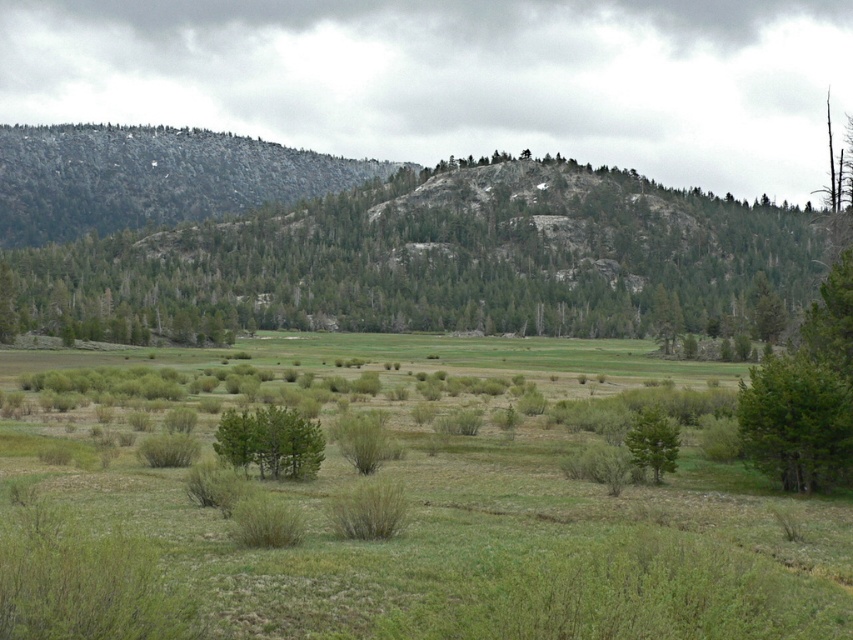
Which of these two, green leafy tree at upper center or rocky gray mountain at left, stands taller?

rocky gray mountain at left is taller.

Is point (444, 209) positioned behind point (27, 204)?

No.

Which is behind, point (254, 273) or point (138, 172)?

The point (138, 172) is more distant.

Identify the location of green leafy tree at upper center. (440, 260).

Does green textured tree at lower right appear under green matte tree at center-right?

No.

Is green textured tree at lower right positioned behind green matte tree at center-right?

No, it is not.

Is point (770, 392) farther from camera compared to point (660, 452)?

No, (770, 392) is in front of (660, 452).

Identify the location of green textured tree at lower right. This screenshot has height=640, width=853. (796, 422).

Who is higher up, rocky gray mountain at left or green matte tree at center?

rocky gray mountain at left is higher up.

Is rocky gray mountain at left to the left of green matte tree at center from the viewer's perspective?

Correct, you'll find rocky gray mountain at left to the left of green matte tree at center.

Is point (248, 166) positioned after point (234, 456)?

Yes.

Where is `rocky gray mountain at left`? rocky gray mountain at left is located at coordinates (152, 177).